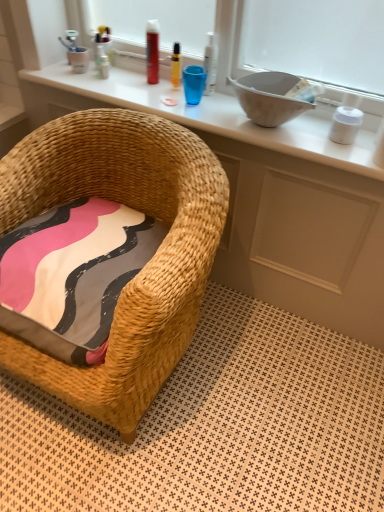
I want to click on vacant space in front of translucent yellow bottle at upper center, the third toiletry viewed from the left, so click(178, 105).